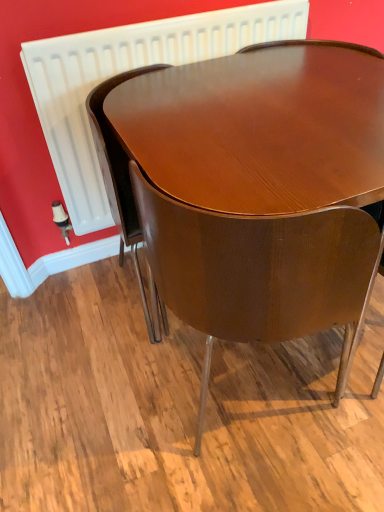
This screenshot has height=512, width=384. What are the coordinates of `free space that is to the left of glossy wood chair at center, which appears as the first chair when viewed from the right` in the screenshot? It's located at click(109, 388).